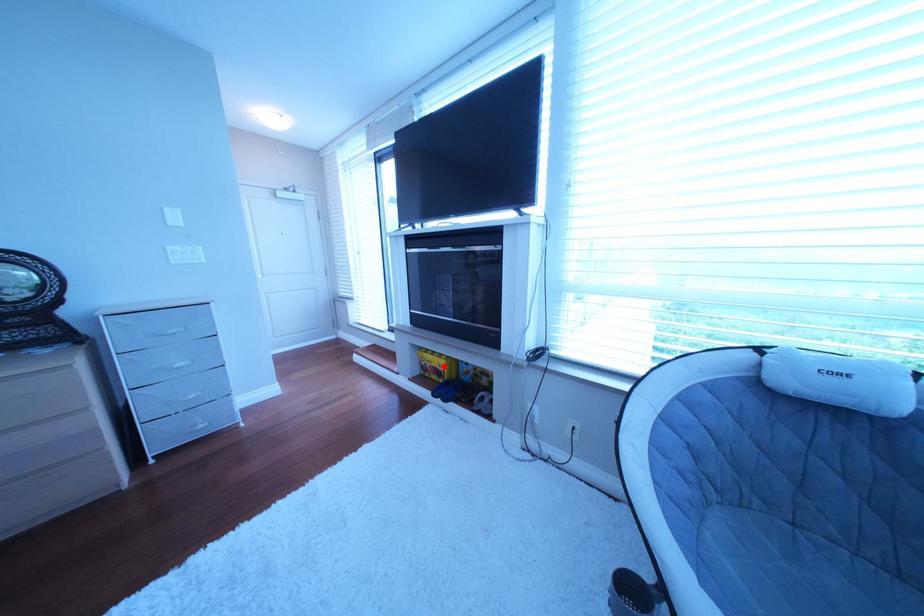
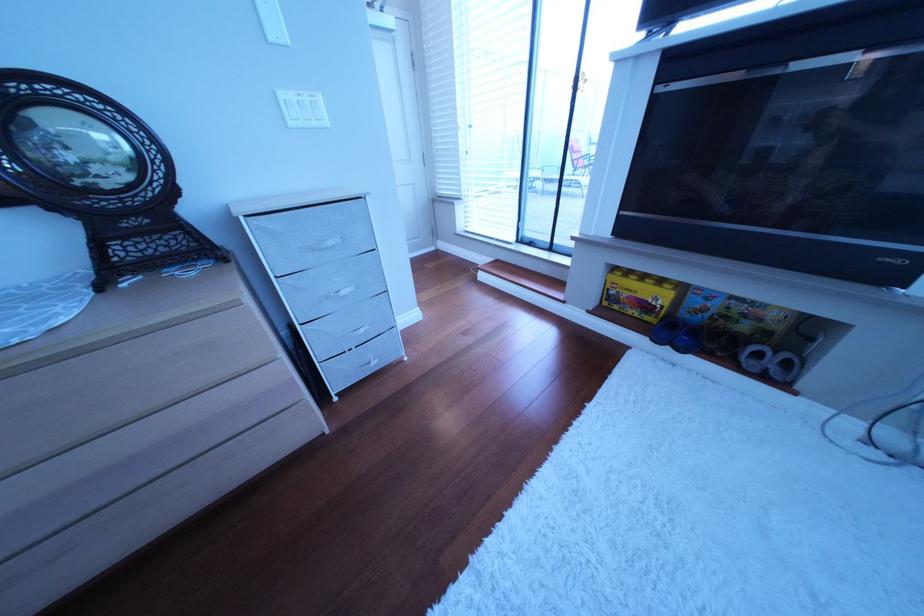
Question: I am providing you with two images of the same scene from different viewpoints. Given a red point in image1, look at the same physical point in image2. Is it:

Choices:
 (A) Closer to the viewpoint
 (B) Farther from the viewpoint

Answer: (A)